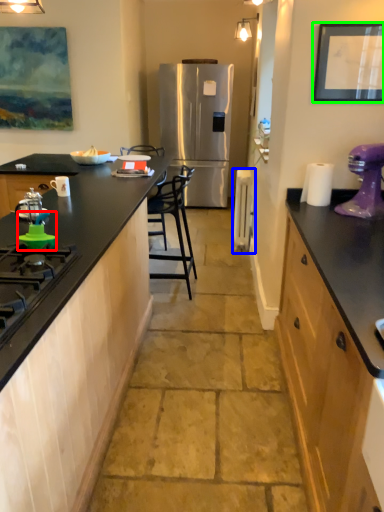
Question: Which is nearer to the appliance (highlighted by a red box)? appliance (highlighted by a blue box) or picture frame (highlighted by a green box).

Choices:
 (A) appliance
 (B) picture frame

Answer: (B)